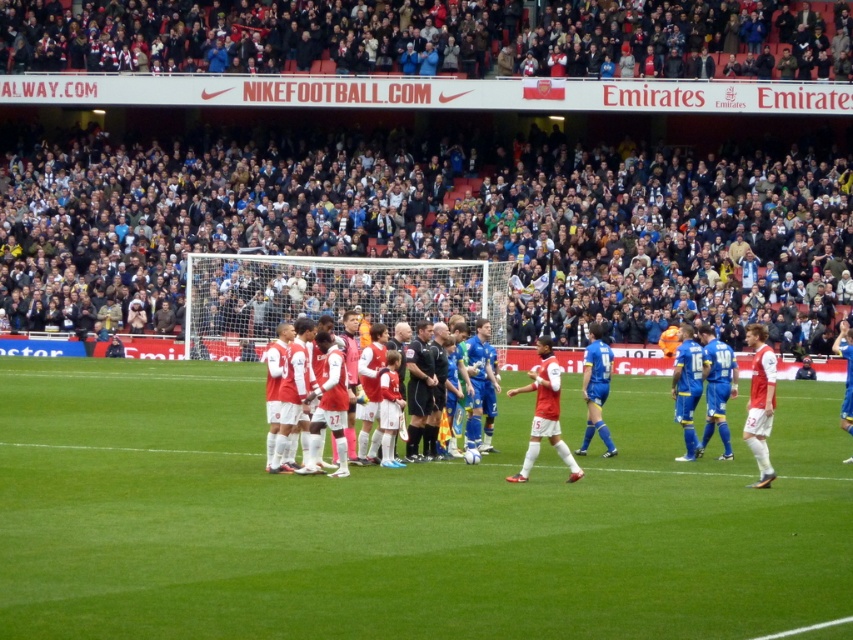
Can you confirm if green grass football field at center is bigger than dark gray stadium seats at upper center?

Incorrect, green grass football field at center is not larger than dark gray stadium seats at upper center.

Does green grass football field at center have a lesser width compared to dark gray stadium seats at upper center?

Yes, green grass football field at center is thinner than dark gray stadium seats at upper center.

This screenshot has width=853, height=640. I want to click on green grass football field at center, so click(398, 520).

Is dark gray stadium seats at upper center bigger than white jersey soccer players at center?

Correct, dark gray stadium seats at upper center is larger in size than white jersey soccer players at center.

Is dark gray stadium seats at upper center to the right of white jersey soccer players at center from the viewer's perspective?

Incorrect, dark gray stadium seats at upper center is not on the right side of white jersey soccer players at center.

Is point (210, 3) closer to camera compared to point (543, 388)?

No.

Locate an element on the screen. The width and height of the screenshot is (853, 640). dark gray stadium seats at upper center is located at coordinates (389, 33).

You are a GUI agent. You are given a task and a screenshot of the screen. Output one action in this format:
    pyautogui.click(x=<x>, y=<y>)
    Task: Click on the dark gray fabric crowd at upper center
    
    Given the screenshot: What is the action you would take?
    pyautogui.click(x=425, y=227)

Does point (229, 72) come closer to viewer compared to point (550, 364)?

No, (229, 72) is further to viewer.

Locate an element on the screen. This screenshot has width=853, height=640. dark gray fabric crowd at upper center is located at coordinates [x=425, y=227].